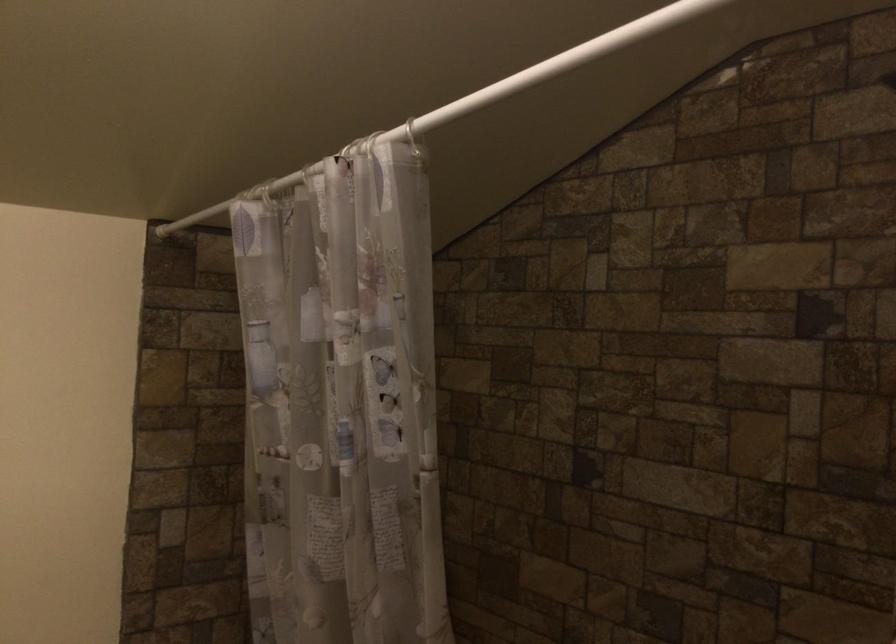
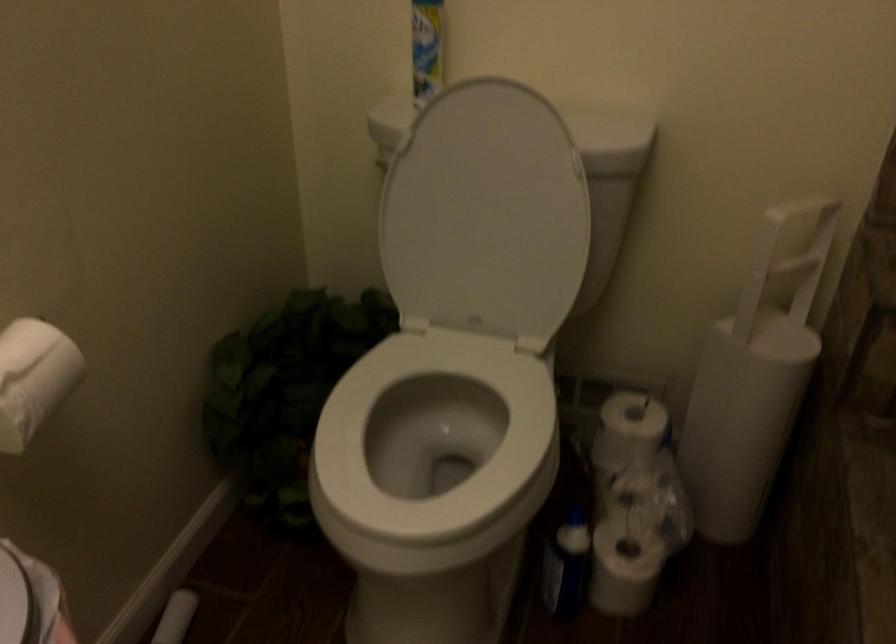
The first image is from the beginning of the video and the second image is from the end. How did the camera likely rotate when shooting the video?

The camera rotated toward left-down.